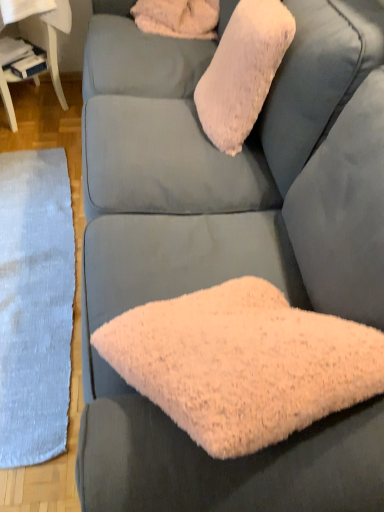
Identify the location of white fluffy pillow at upper center. (177, 18).

I want to click on fluffy pink pillow at upper center, so click(243, 71).

Locate an element on the screen. white glossy table at lower left is located at coordinates (31, 46).

Who is shorter, fluffy pink pillow at upper center or white fluffy pillow at upper center?

Standing shorter between the two is white fluffy pillow at upper center.

From the image's perspective, which is below, fluffy pink pillow at upper center or white fluffy pillow at upper center?

fluffy pink pillow at upper center is shown below in the image.

Looking at this image, in the image, is fluffy pink pillow at upper center positioned in front of or behind white fluffy pillow at upper center?

In the image, fluffy pink pillow at upper center appears in front of white fluffy pillow at upper center.

Considering the sizes of objects fluffy pink pillow at upper center and white fluffy pillow at upper center in the image provided, who is bigger, fluffy pink pillow at upper center or white fluffy pillow at upper center?

Bigger between the two is fluffy pink pillow at upper center.

From the image's perspective, which is below, white glossy table at lower left or fluffy pink pillow at upper center?

From the image's view, fluffy pink pillow at upper center is below.

Is white glossy table at lower left positioned far away from fluffy pink pillow at upper center?

They are positioned close to each other.

From the picture: Could fluffy pink pillow at upper center be considered to be inside white glossy table at lower left?

No, fluffy pink pillow at upper center is not a part of white glossy table at lower left.

Is white glossy table at lower left bigger than gray woolen mat at left?

Yes.

Is white glossy table at lower left oriented towards gray woolen mat at left?

Yes, white glossy table at lower left faces towards gray woolen mat at left.

Can you confirm if white glossy table at lower left is taller than gray woolen mat at left?

Indeed, white glossy table at lower left has a greater height compared to gray woolen mat at left.

Is white glossy table at lower left next to gray woolen mat at left?

white glossy table at lower left and gray woolen mat at left are not in contact.

From a real-world perspective, is white fluffy pillow at upper center physically located above or below gray woolen mat at left?

From a real-world perspective, white fluffy pillow at upper center is physically above gray woolen mat at left.

From their relative heights in the image, would you say white fluffy pillow at upper center is taller or shorter than gray woolen mat at left?

Considering their sizes, white fluffy pillow at upper center has more height than gray woolen mat at left.

Does white fluffy pillow at upper center lie behind gray woolen mat at left?

Yes.

Is point (195, 15) farther from viewer compared to point (28, 400)?

Yes, point (195, 15) is farther from viewer.

Does white glossy table at lower left have a smaller size compared to white fluffy pillow at upper center?

Actually, white glossy table at lower left might be larger than white fluffy pillow at upper center.

Is white glossy table at lower left not close to white fluffy pillow at upper center?

That's not correct — white glossy table at lower left is a little close to white fluffy pillow at upper center.

Is white glossy table at lower left turned away from white fluffy pillow at upper center?

That's not correct — white glossy table at lower left is not looking away from white fluffy pillow at upper center.

Does white glossy table at lower left have a greater width compared to white fluffy pillow at upper center?

Indeed, white glossy table at lower left has a greater width compared to white fluffy pillow at upper center.

In the scene shown: Which object is thinner, gray woolen mat at left or white glossy table at lower left?

gray woolen mat at left.

Between gray woolen mat at left and white glossy table at lower left, which one appears on the left side from the viewer's perspective?

white glossy table at lower left is more to the left.

Who is bigger, gray woolen mat at left or white glossy table at lower left?

With larger size is white glossy table at lower left.

Is fluffy pink pillow at upper center not inside gray woolen mat at left?

Absolutely, fluffy pink pillow at upper center is external to gray woolen mat at left.

At what (x,y) coordinates should I click in order to perform the action: click on throw pillow that is above the gray woolen mat at left (from the image's perspective). Please return your answer as a coordinate pair (x, y). The height and width of the screenshot is (512, 384). Looking at the image, I should click on (243, 71).

Between fluffy pink pillow at upper center and gray woolen mat at left, which one has less height?

With less height is gray woolen mat at left.

How different are the orientations of fluffy pink pillow at upper center and gray woolen mat at left in degrees?

The facing directions of fluffy pink pillow at upper center and gray woolen mat at left are 5.82 degrees apart.

Where is `pillow located on the left of fluffy pink pillow at upper center`? The image size is (384, 512). pillow located on the left of fluffy pink pillow at upper center is located at coordinates (177, 18).

Find the location of a particular element. Image resolution: width=384 pixels, height=512 pixels. table located behind the fluffy pink pillow at upper center is located at coordinates (31, 46).

Based on their spatial positions, is white glossy table at lower left or gray woolen mat at left further from white fluffy pillow at upper center?

gray woolen mat at left lies further to white fluffy pillow at upper center than the other object.

When comparing their distances from white fluffy pillow at upper center, does fluffy pink pillow at upper center or white glossy table at lower left seem closer?

white glossy table at lower left.

Looking at the image, which one is located further to gray woolen mat at left, white glossy table at lower left or white fluffy pillow at upper center?

white fluffy pillow at upper center is positioned further to the anchor gray woolen mat at left.

When comparing their distances from gray woolen mat at left, does fluffy pink pillow at upper center or white glossy table at lower left seem further?

fluffy pink pillow at upper center is further to gray woolen mat at left.

When comparing their distances from white fluffy pillow at upper center, does white glossy table at lower left or fluffy pink pillow at upper center seem further?

fluffy pink pillow at upper center.

From the image, which object appears to be farther from white glossy table at lower left, gray woolen mat at left or fluffy pink pillow at upper center?

Based on the image, fluffy pink pillow at upper center appears to be further to white glossy table at lower left.

Looking at the image, which one is located closer to white glossy table at lower left, fluffy pink pillow at upper center or white fluffy pillow at upper center?

white fluffy pillow at upper center is closer to white glossy table at lower left.

Considering their positions, is fluffy pink pillow at upper center positioned closer to white glossy table at lower left than gray woolen mat at left?

gray woolen mat at left lies closer to white glossy table at lower left than the other object.

Where is `pillow between white glossy table at lower left and fluffy pink pillow at upper center`? pillow between white glossy table at lower left and fluffy pink pillow at upper center is located at coordinates click(x=177, y=18).

This screenshot has width=384, height=512. Find the location of `throw pillow between white fluffy pillow at upper center and gray woolen mat at left in the vertical direction`. throw pillow between white fluffy pillow at upper center and gray woolen mat at left in the vertical direction is located at coordinates (243, 71).

In order to click on table between white fluffy pillow at upper center and gray woolen mat at left in the up-down direction in this screenshot , I will do `click(31, 46)`.

Locate an element on the screen. The image size is (384, 512). throw pillow between white glossy table at lower left and gray woolen mat at left in the up-down direction is located at coordinates (243, 71).